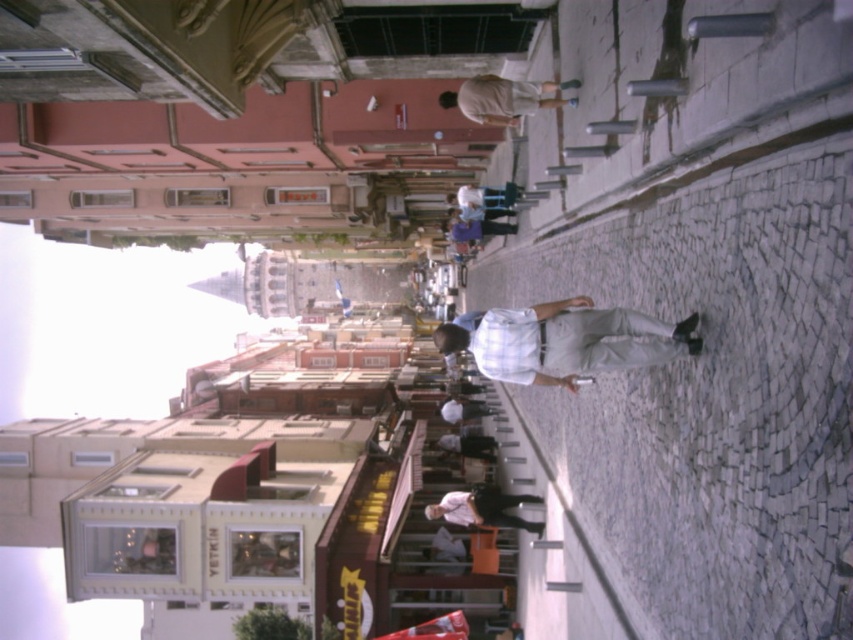
Is white plaid shirt at center thinner than light brown wooden skateboard at center?

Incorrect, white plaid shirt at center's width is not less than light brown wooden skateboard at center's.

Describe the element at coordinates (566, 340) in the screenshot. I see `white plaid shirt at center` at that location.

Find the location of a particular element. The image size is (853, 640). white plaid shirt at center is located at coordinates (566, 340).

Image resolution: width=853 pixels, height=640 pixels. Describe the element at coordinates (503, 99) in the screenshot. I see `light brown wooden skateboard at center` at that location.

Can you confirm if light brown wooden skateboard at center is smaller than white shirt at center?

Indeed, light brown wooden skateboard at center has a smaller size compared to white shirt at center.

Image resolution: width=853 pixels, height=640 pixels. What do you see at coordinates (503, 99) in the screenshot?
I see `light brown wooden skateboard at center` at bounding box center [503, 99].

Where is `light brown wooden skateboard at center`? light brown wooden skateboard at center is located at coordinates (503, 99).

How distant is white plaid shirt at center from white shirt at center?

white plaid shirt at center and white shirt at center are 16.05 meters apart.

Between white plaid shirt at center and white shirt at center, which one appears on the right side from the viewer's perspective?

white plaid shirt at center

The width and height of the screenshot is (853, 640). Find the location of `white plaid shirt at center`. white plaid shirt at center is located at coordinates (566, 340).

Where is `white plaid shirt at center`? This screenshot has height=640, width=853. white plaid shirt at center is located at coordinates (566, 340).